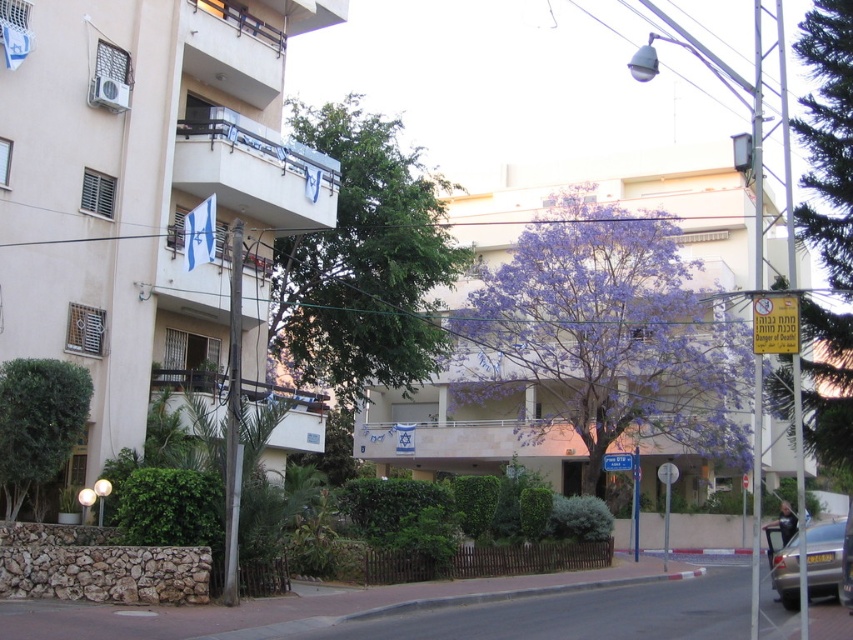
Question: Which object is closer to the camera taking this photo?

Choices:
 (A) purple leafy tree at center
 (B) green leafy bush at lower left

Answer: (B)

Question: From the image, what is the correct spatial relationship of purple leafy tree at upper right in relation to green leafy bush at lower left?

Choices:
 (A) right
 (B) left

Answer: (A)

Question: Which point is closer to the camera taking this photo?

Choices:
 (A) (624, 468)
 (B) (283, 323)
 (C) (86, 385)
 (D) (560, 317)

Answer: (C)

Question: Estimate the real-world distances between objects in this image. Which object is closer to the silver metallic car at lower right?

Choices:
 (A) blue metallic street sign at upper center
 (B) green leafy tree at center
 (C) purple leafy tree at center

Answer: (A)

Question: Does purple leafy tree at center come in front of green leafy bush at lower left?

Choices:
 (A) yes
 (B) no

Answer: (B)

Question: Is the position of silver metallic car at lower right more distant than that of blue metallic street sign at upper center?

Choices:
 (A) no
 (B) yes

Answer: (A)